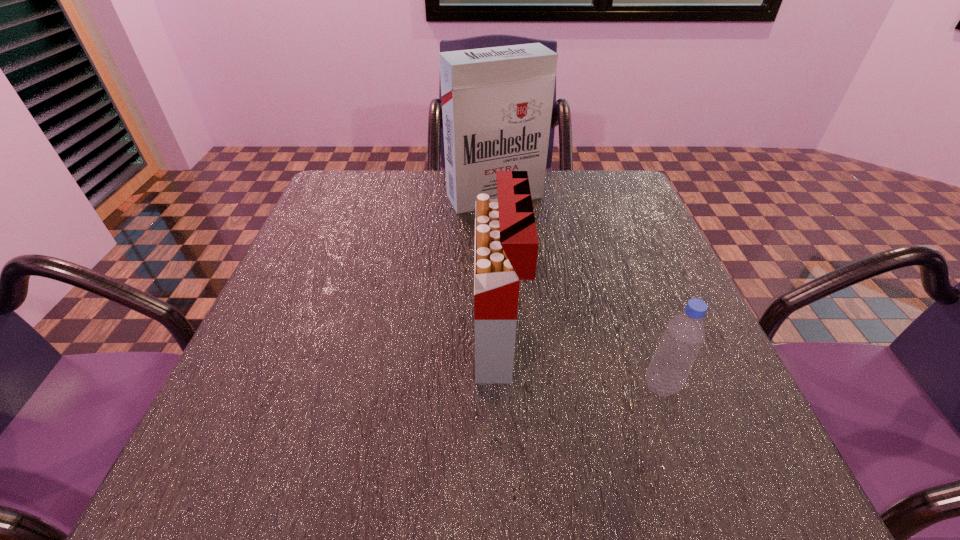
Where is `free space located 0.340m on the left of the shortest object`? free space located 0.340m on the left of the shortest object is located at coordinates click(x=439, y=386).

What are the coordinates of `object that is at the far edge` in the screenshot? It's located at (497, 102).

At what (x,y) coordinates should I click in order to perform the action: click on object at the right edge. Please return your answer as a coordinate pair (x, y). The width and height of the screenshot is (960, 540). Looking at the image, I should click on [684, 335].

The image size is (960, 540). In order to click on vacant area at the near edge in this screenshot , I will do `click(494, 492)`.

The image size is (960, 540). In the image, there is a desktop. Identify the location of vacant space at the left edge. (210, 431).

What are the coordinates of `blank area at the right edge` in the screenshot? It's located at (660, 256).

Identify the location of free region at the far left corner. (369, 212).

In the image, there is a desktop. Where is `vacant region at the near left corner`? Image resolution: width=960 pixels, height=540 pixels. vacant region at the near left corner is located at coordinates click(x=225, y=446).

Locate an element on the screen. vacant area at the far right corner is located at coordinates (578, 187).

I want to click on free spot between the bottle and the shorter cigarette case, so click(x=580, y=363).